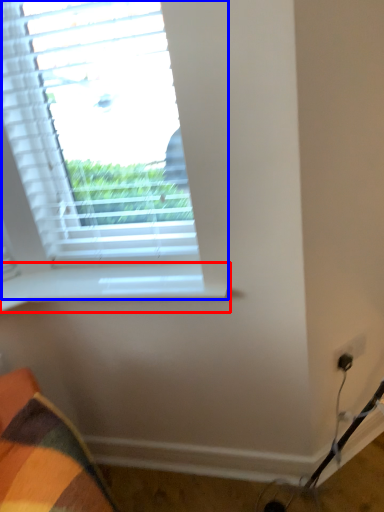
Question: Among these objects, which one is nearest to the camera, window sill (highlighted by a red box) or window (highlighted by a blue box)?

Choices:
 (A) window sill
 (B) window

Answer: (B)